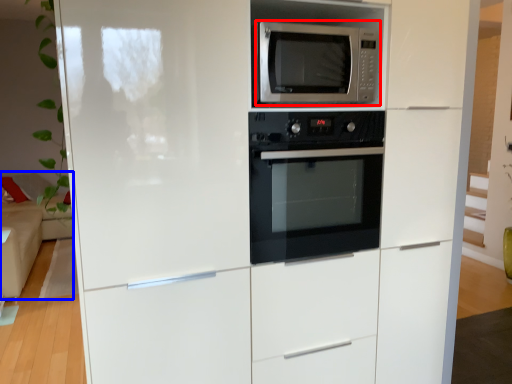
Question: Which of the following is the closest to the observer, microwave oven (highlighted by a red box) or couch (highlighted by a blue box)?

Choices:
 (A) microwave oven
 (B) couch

Answer: (A)